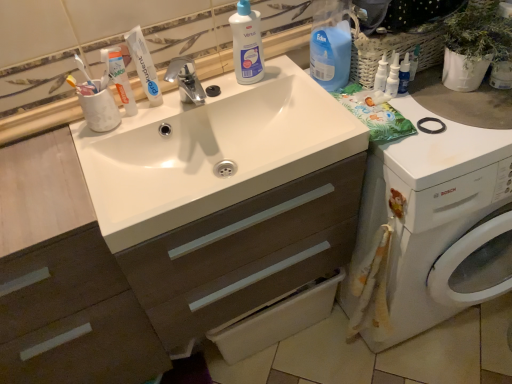
You are a GUI agent. You are given a task and a screenshot of the screen. Output one action in this format:
    pyautogui.click(x=<x>, y=<y>)
    Task: Click on the vacant region above white glossy sink at center (from a real-world perspective)
    This screenshot has width=512, height=384.
    Given the screenshot: What is the action you would take?
    pyautogui.click(x=98, y=164)